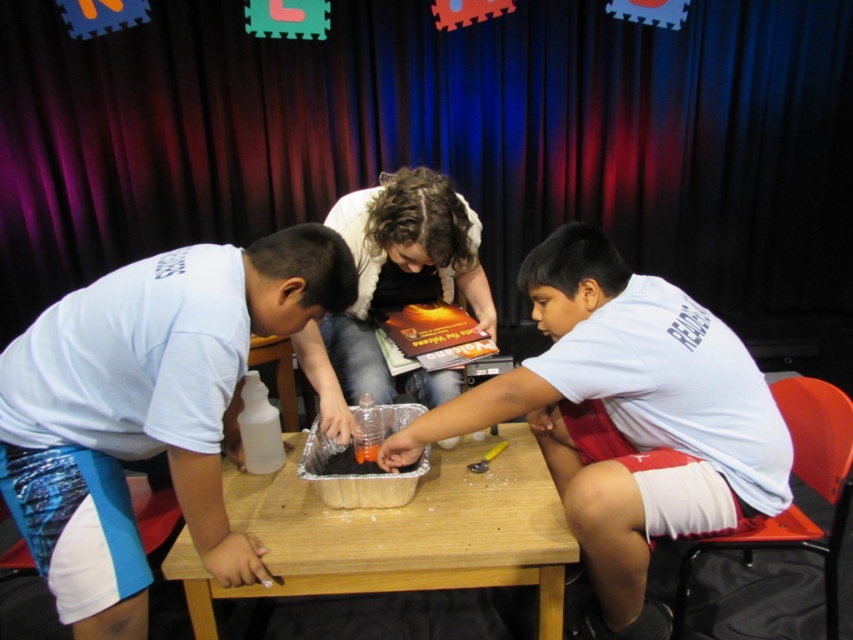
You are a photographer setting up for a group photo. You need to position the white matte shirt at left and the wooden table at center so that the table is visible in the background. Is the current arrangement suitable?

Yes, the current arrangement is suitable because the white matte shirt at left is in front of the wooden table at center, allowing the table to be visible in the background.